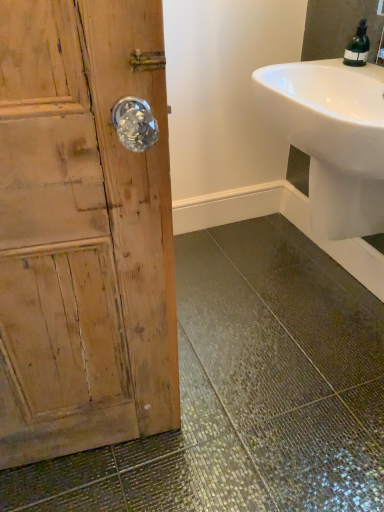
Question: Is white glossy sink at upper right wider or thinner than green matte bottle at upper right?

Choices:
 (A) thin
 (B) wide

Answer: (B)

Question: Is white glossy sink at upper right taller or shorter than green matte bottle at upper right?

Choices:
 (A) short
 (B) tall

Answer: (B)

Question: Visually, is white glossy sink at upper right positioned to the left or to the right of green matte bottle at upper right?

Choices:
 (A) left
 (B) right

Answer: (A)

Question: From a real-world perspective, is green matte bottle at upper right above or below white glossy sink at upper right?

Choices:
 (A) above
 (B) below

Answer: (A)

Question: From the image's perspective, is green matte bottle at upper right located above or below white glossy sink at upper right?

Choices:
 (A) above
 (B) below

Answer: (A)

Question: Is green matte bottle at upper right taller or shorter than white glossy sink at upper right?

Choices:
 (A) short
 (B) tall

Answer: (A)

Question: In the image, is green matte bottle at upper right positioned in front of or behind white glossy sink at upper right?

Choices:
 (A) front
 (B) behind

Answer: (B)